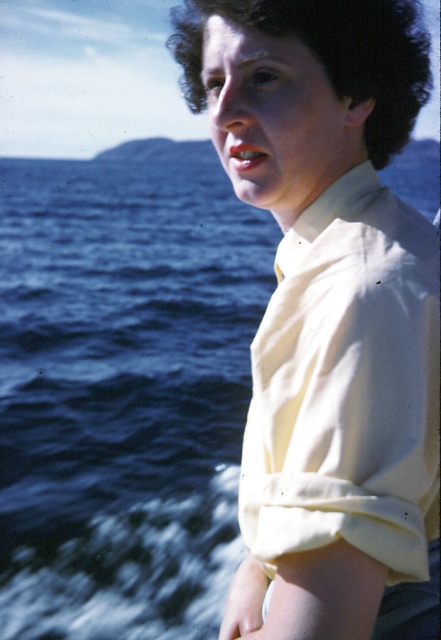
Question: In this image, where is white cotton shirt at right located relative to dark curly hair at upper center?

Choices:
 (A) below
 (B) above

Answer: (A)

Question: Is white matte shirt at upper right thinner than white cotton shirt at right?

Choices:
 (A) yes
 (B) no

Answer: (B)

Question: Estimate the real-world distances between objects in this image. Which object is farther from the white matte shirt at upper right?

Choices:
 (A) dark curly hair at upper center
 (B) white cotton shirt at right

Answer: (A)

Question: Is white matte shirt at upper right further to the viewer compared to white cotton shirt at right?

Choices:
 (A) no
 (B) yes

Answer: (B)

Question: Which of the following is the farthest from the observer?

Choices:
 (A) dark curly hair at upper center
 (B) white matte shirt at upper right

Answer: (A)

Question: Based on their relative distances, which object is farther from the dark curly hair at upper center?

Choices:
 (A) white cotton shirt at right
 (B) white matte shirt at upper right

Answer: (B)